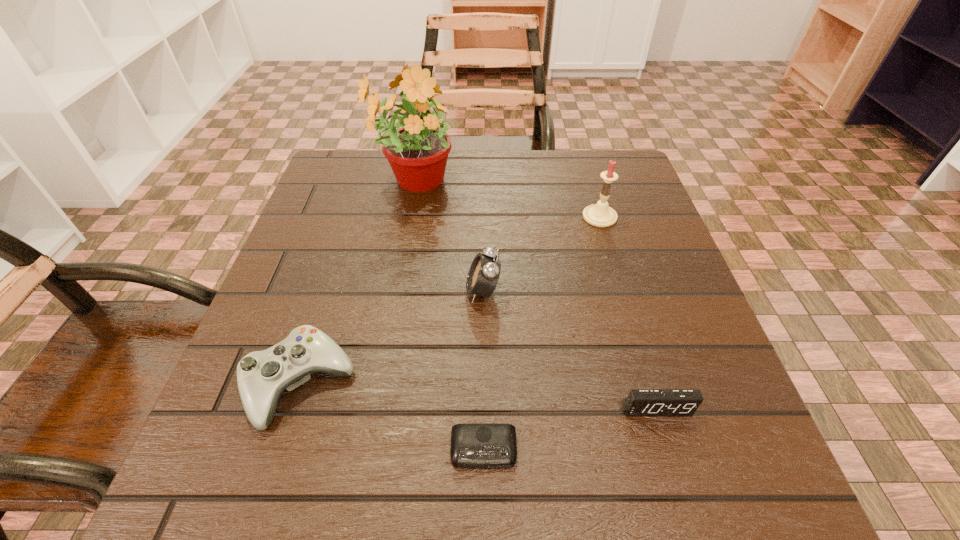
Where is `object that ranks as the fifth closest to the second tallest alarm clock`? The width and height of the screenshot is (960, 540). object that ranks as the fifth closest to the second tallest alarm clock is located at coordinates (417, 152).

Select which object is the fourth closest to the candle. Please provide its 2D coordinates. Your answer should be formatted as a tuple, i.e. [(x, y)], where the tuple contains the x and y coordinates of a point satisfying the conditions above.

[(473, 445)]

Point out which alarm clock is positioned as the nearest to the candle. Please provide its 2D coordinates. Your answer should be formatted as a tuple, i.e. [(x, y)], where the tuple contains the x and y coordinates of a point satisfying the conditions above.

[(484, 272)]

The height and width of the screenshot is (540, 960). Find the location of `alarm clock that is the second nearest to the farthest alarm clock`. alarm clock that is the second nearest to the farthest alarm clock is located at coordinates (640, 402).

Find the location of a particular element. Image resolution: width=960 pixels, height=540 pixels. vacant point that satisfies the following two spatial constraints: 1. on the back side of the control; 2. on the left side of the flowerpot is located at coordinates (365, 181).

At what (x,y) coordinates should I click in order to perform the action: click on free spot that satisfies the following two spatial constraints: 1. on the back side of the control; 2. on the right side of the tallest object. Please return your answer as a coordinate pair (x, y). The height and width of the screenshot is (540, 960). Looking at the image, I should click on tap(365, 181).